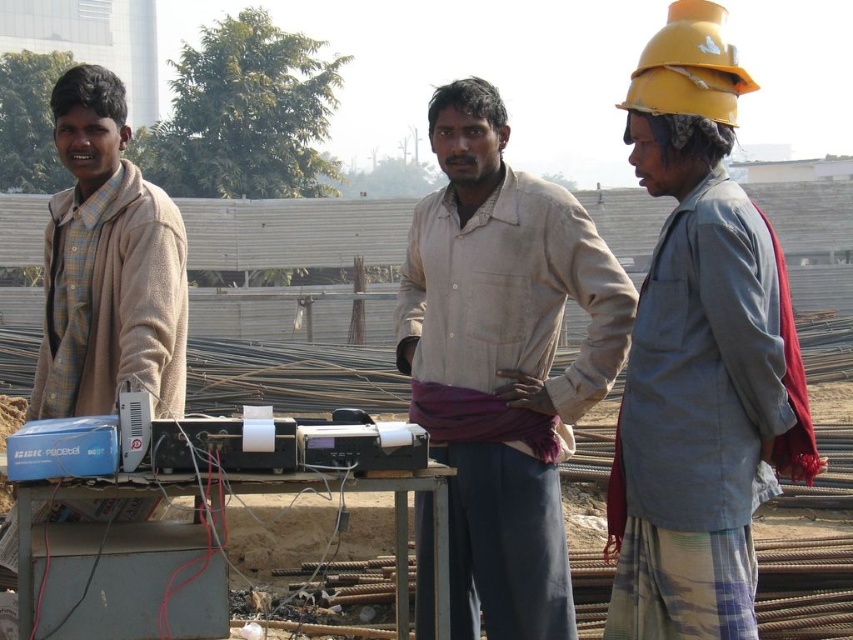
You are a safety inspector at the construction site. You need to ensure that the gray fabric shirt at right and the yellow matte hard hat at upper right are both visible to the camera. Based on their sizes, which object is more likely to block the view of the other?

The gray fabric shirt at right is larger in size than the yellow matte hard hat at upper right, so it is more likely to block the view of the yellow matte hard hat at upper right.

You are a safety inspector at this construction site. You notice the checkered fabric shirt at left and the yellow matte hard hat at upper right. Which object is nearer to you?

The checkered fabric shirt at left is closer to the viewer than the yellow matte hard hat at upper right.